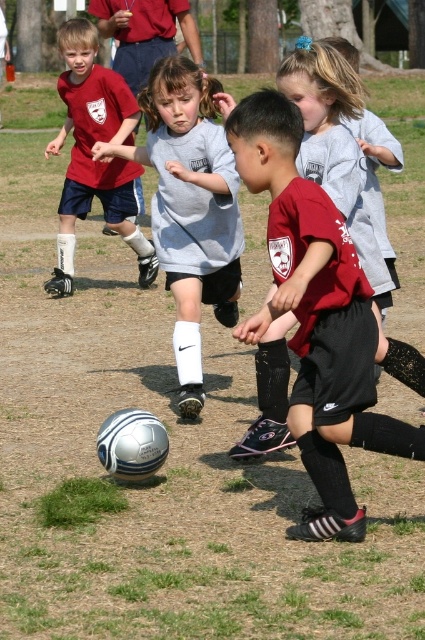
Question: Among these points, which one is farthest from the camera?

Choices:
 (A) (78, 141)
 (B) (209, 136)

Answer: (A)

Question: Can you confirm if matte red shirt at center is positioned to the left of matte red shirt at left?

Choices:
 (A) no
 (B) yes

Answer: (A)

Question: Is white matte soccer ball at center below matte red shirt at left?

Choices:
 (A) no
 (B) yes

Answer: (B)

Question: Among these points, which one is nearest to the camera?

Choices:
 (A) coord(87,51)
 (B) coord(283,129)

Answer: (B)

Question: Estimate the real-world distances between objects in this image. Which object is farther from the gray cotton shirt at upper center?

Choices:
 (A) matte red shirt at center
 (B) white matte soccer ball at center
 (C) matte red shirt at left

Answer: (C)

Question: Does matte red shirt at center have a lesser width compared to gray cotton shirt at upper center?

Choices:
 (A) yes
 (B) no

Answer: (B)